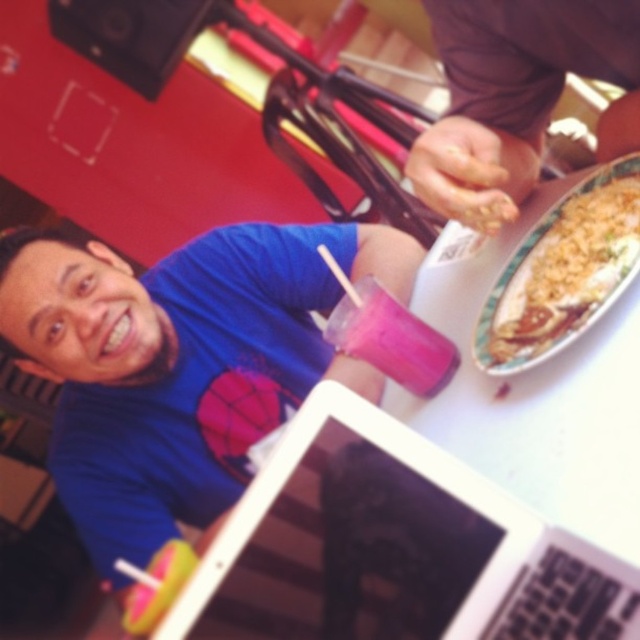
Is brown matte hand at upper center bigger than pink matte cup at center?

Yes.

The height and width of the screenshot is (640, 640). Find the location of `brown matte hand at upper center`. brown matte hand at upper center is located at coordinates coord(509,93).

Is point (472, 157) positioned behind point (362, 296)?

No, (472, 157) is closer to viewer.

Locate an element on the screen. Image resolution: width=640 pixels, height=640 pixels. brown matte hand at upper center is located at coordinates (509, 93).

Is blue matte shirt at center smaller than brown matte hand at upper center?

Actually, blue matte shirt at center might be larger than brown matte hand at upper center.

Between blue matte shirt at center and brown matte hand at upper center, which one appears on the left side from the viewer's perspective?

blue matte shirt at center is more to the left.

Locate an element on the screen. blue matte shirt at center is located at coordinates (180, 364).

Who is shorter, white glossy laptop at center or brown matte hand at upper center?

Standing shorter between the two is white glossy laptop at center.

Which is above, white glossy laptop at center or brown matte hand at upper center?

brown matte hand at upper center is above.

This screenshot has height=640, width=640. What are the coordinates of `white glossy laptop at center` in the screenshot? It's located at (394, 547).